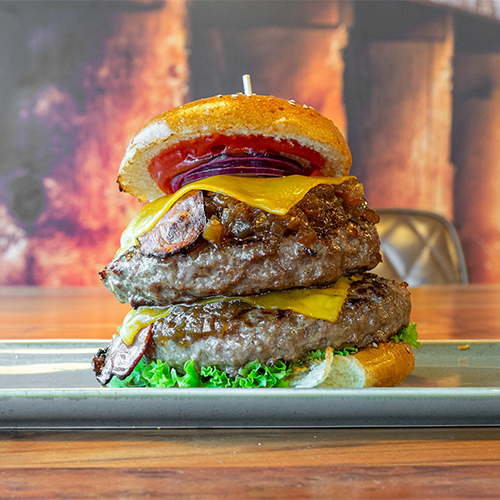
Locate an element on the screen. The height and width of the screenshot is (500, 500). wooden table is located at coordinates (334, 462).